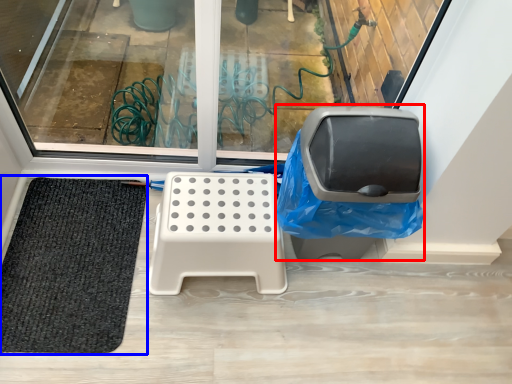
Question: Which object is further to the camera taking this photo, swivel chair (highlighted by a red box) or mat (highlighted by a blue box)?

Choices:
 (A) swivel chair
 (B) mat

Answer: (B)